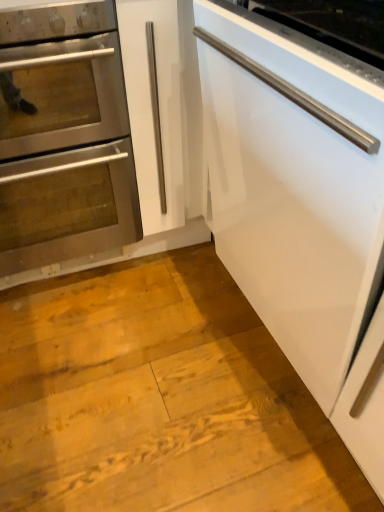
Question: Visually, is stainless steel oven at left positioned to the left or to the right of white glossy dishwasher at right?

Choices:
 (A) left
 (B) right

Answer: (A)

Question: In terms of size, does stainless steel oven at left appear bigger or smaller than white glossy dishwasher at right?

Choices:
 (A) big
 (B) small

Answer: (B)

Question: From the image's perspective, is stainless steel oven at left positioned above or below white glossy dishwasher at right?

Choices:
 (A) below
 (B) above

Answer: (B)

Question: Relative to stainless steel oven at left, is white glossy dishwasher at right in front or behind?

Choices:
 (A) front
 (B) behind

Answer: (A)

Question: Is white glossy dishwasher at right spatially inside stainless steel oven at left, or outside of it?

Choices:
 (A) inside
 (B) outside

Answer: (B)

Question: From their relative heights in the image, would you say white glossy dishwasher at right is taller or shorter than stainless steel oven at left?

Choices:
 (A) short
 (B) tall

Answer: (A)

Question: From the image's perspective, is white glossy dishwasher at right above or below stainless steel oven at left?

Choices:
 (A) above
 (B) below

Answer: (B)